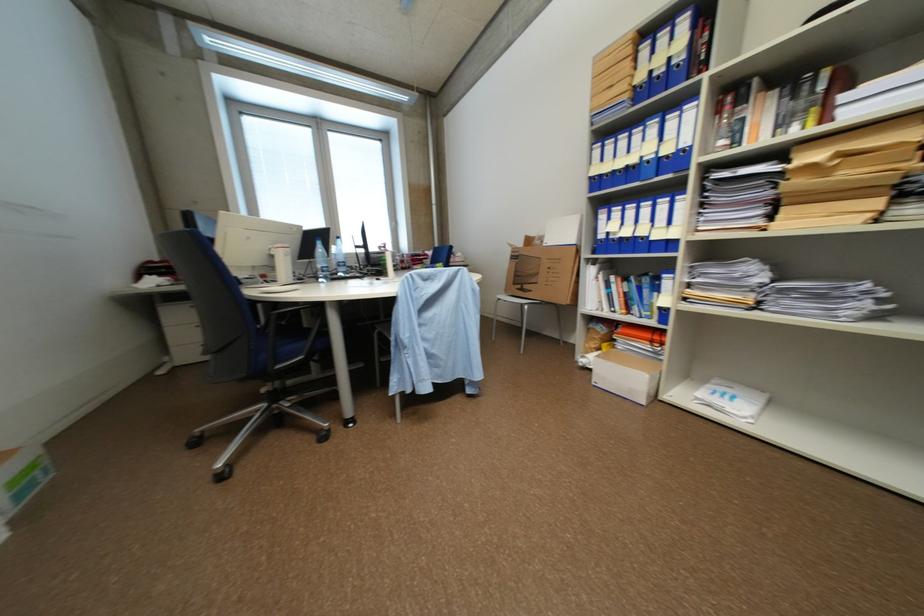
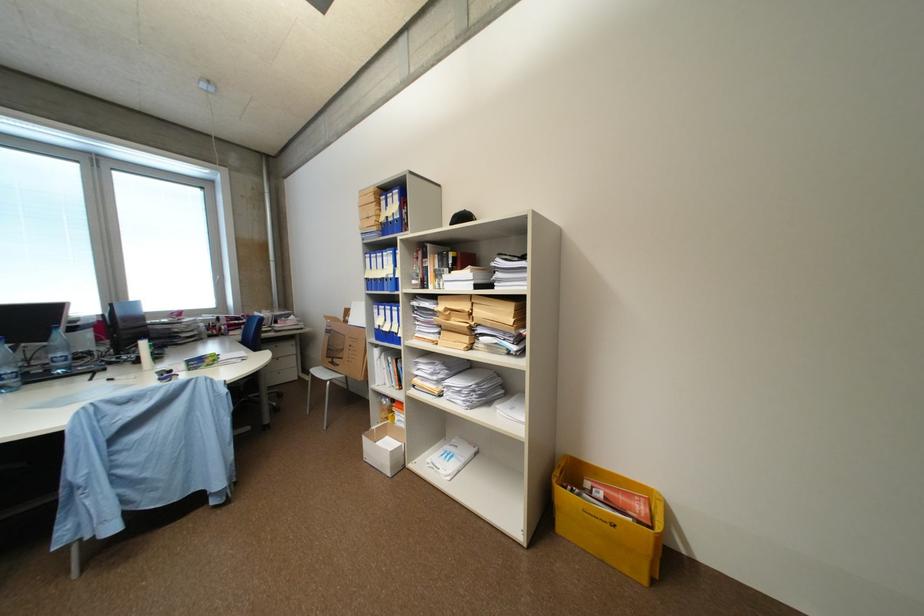
Where in the second image is the point corresponding to (524,277) from the first image?

(336, 350)